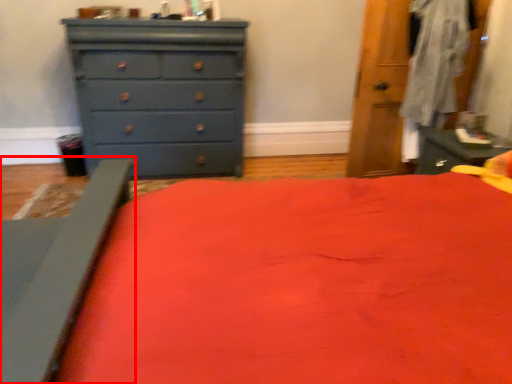
Question: From the image's perspective, what is the correct spatial relationship of bed frame (annotated by the red box) in relation to chest of drawers?

Choices:
 (A) below
 (B) above

Answer: (A)